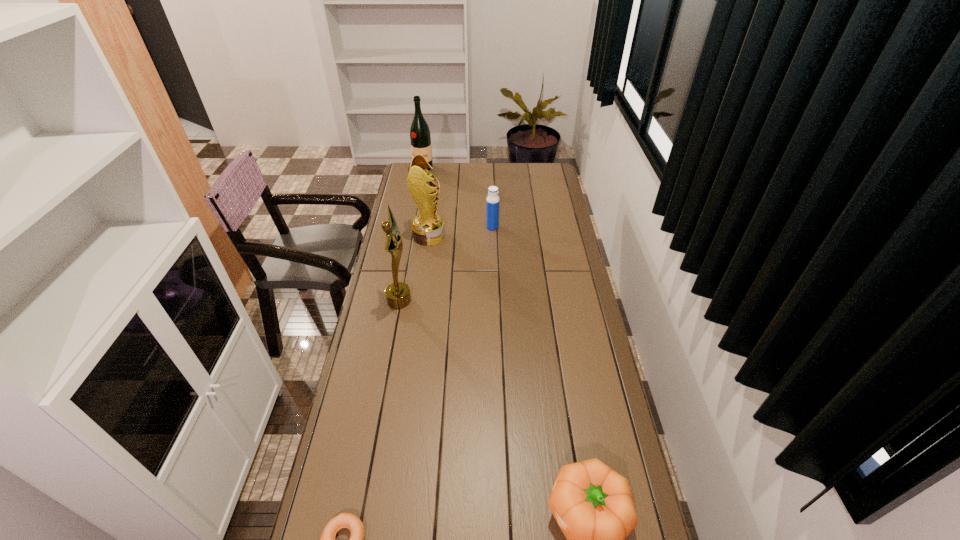
The height and width of the screenshot is (540, 960). What are the coordinates of `wine bottle` in the screenshot? It's located at tap(420, 137).

At what (x,y) coordinates should I click in order to perform the action: click on the nearer award. Please return your answer as a coordinate pair (x, y). This screenshot has width=960, height=540. Looking at the image, I should click on (397, 294).

You are a GUI agent. You are given a task and a screenshot of the screen. Output one action in this format:
    pyautogui.click(x=<x>, y=<y>)
    Task: Click on the farther award
    The width and height of the screenshot is (960, 540).
    Given the screenshot: What is the action you would take?
    pyautogui.click(x=427, y=227)

The width and height of the screenshot is (960, 540). I want to click on the fourth tallest object, so click(492, 202).

Where is `water bottle`? water bottle is located at coordinates (492, 202).

This screenshot has height=540, width=960. Find the location of `vacant space located on the right of the farthest object`. vacant space located on the right of the farthest object is located at coordinates (444, 170).

The height and width of the screenshot is (540, 960). I want to click on free space located 0.160m on the front-facing side of the third nearest object, so click(x=451, y=300).

You are a GUI agent. You are given a task and a screenshot of the screen. Output one action in this format:
    pyautogui.click(x=<x>, y=<y>)
    Task: Click on the vacant space situated on the front-facing side of the farther award
    The width and height of the screenshot is (960, 540).
    Given the screenshot: What is the action you would take?
    pyautogui.click(x=479, y=236)

Locate an element on the screen. vacant space located on the front of the fifth object from left to right is located at coordinates (493, 272).

Where is `object present at the far edge`? The height and width of the screenshot is (540, 960). object present at the far edge is located at coordinates (420, 137).